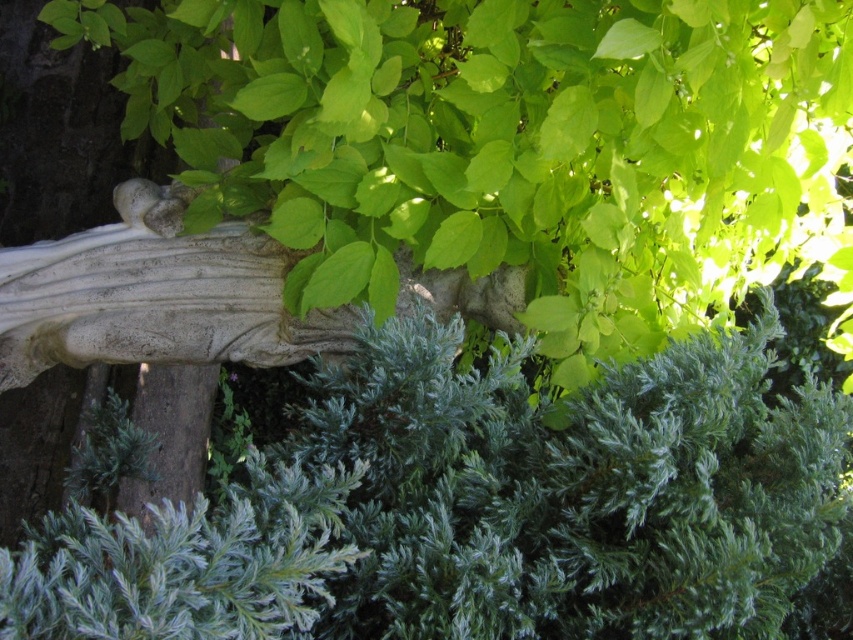
Is point (692, 416) positioned before point (268, 362)?

That is True.

Is green textured bush at center above white stone sculpture at center?

No.

Image resolution: width=853 pixels, height=640 pixels. What do you see at coordinates (476, 508) in the screenshot? I see `green textured bush at center` at bounding box center [476, 508].

You are a GUI agent. You are given a task and a screenshot of the screen. Output one action in this format:
    pyautogui.click(x=<x>, y=<y>)
    Task: Click on the green textured bush at center
    
    Given the screenshot: What is the action you would take?
    pyautogui.click(x=476, y=508)